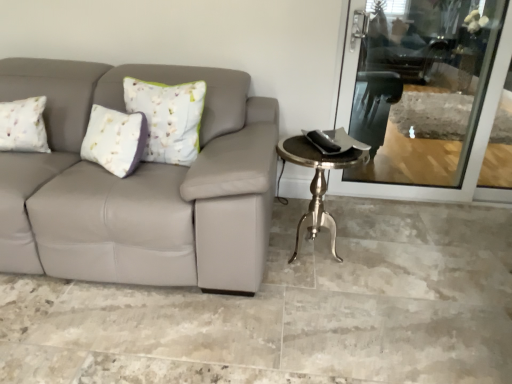
This screenshot has height=384, width=512. I want to click on vacant area that lies in front of silver metallic table at right, so click(x=321, y=310).